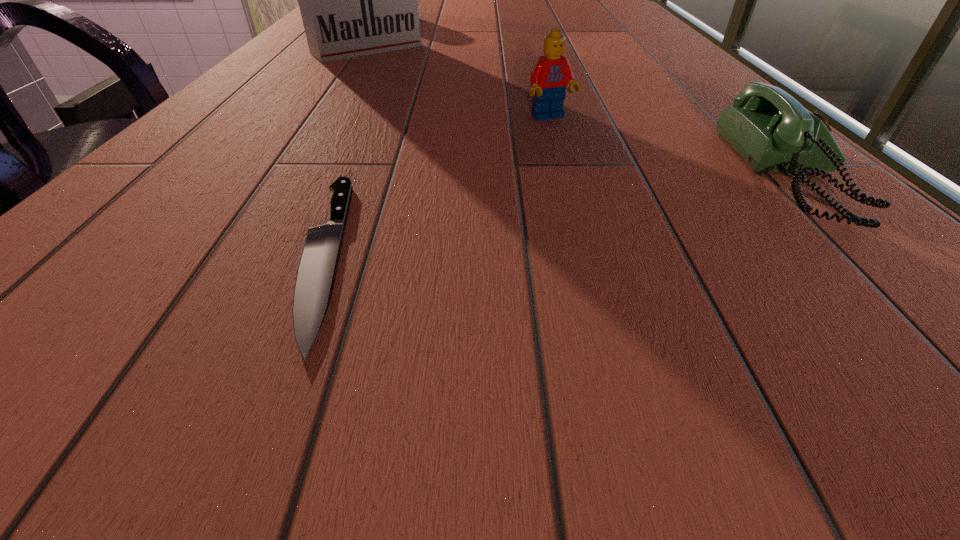
You are a GUI agent. You are given a task and a screenshot of the screen. Output one action in this format:
    pyautogui.click(x=<x>, y=<y>)
    Task: Click on the free space on the desktop that is between the shortest object and the rightmost object and is positioned on the face of the Lego
    
    Given the screenshot: What is the action you would take?
    pyautogui.click(x=637, y=204)

Locate an element on the screen. This screenshot has width=960, height=540. free spot on the desktop that is between the shortest object and the telephone and is positioned with the lid open on the cigarette case is located at coordinates (625, 206).